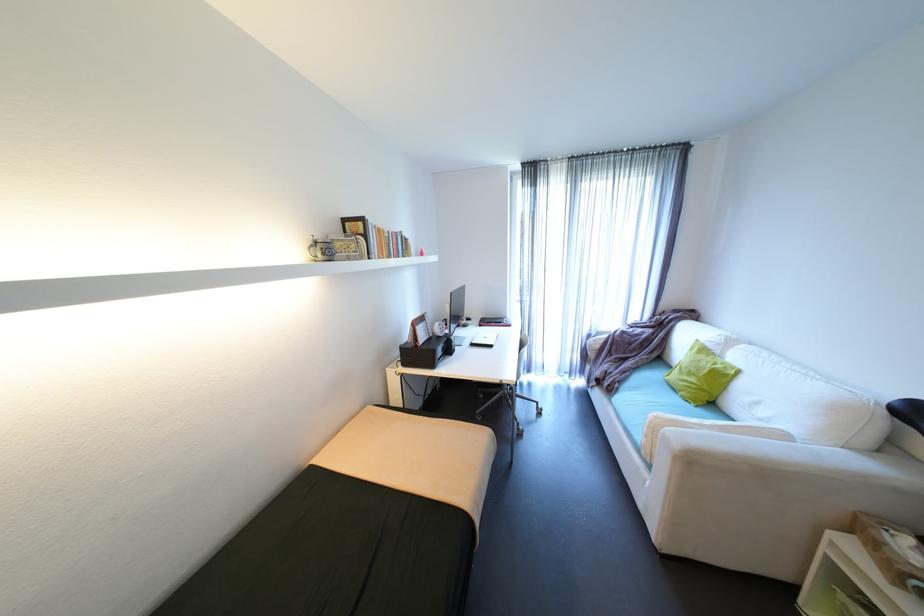
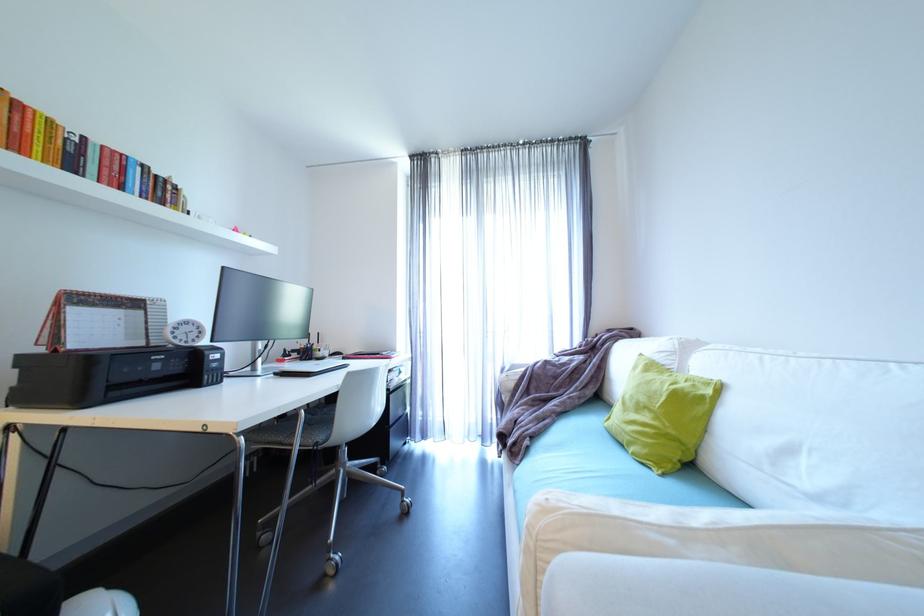
What movement of the cameraman would produce the second image?

The movement direction of the cameraman is right, forward.